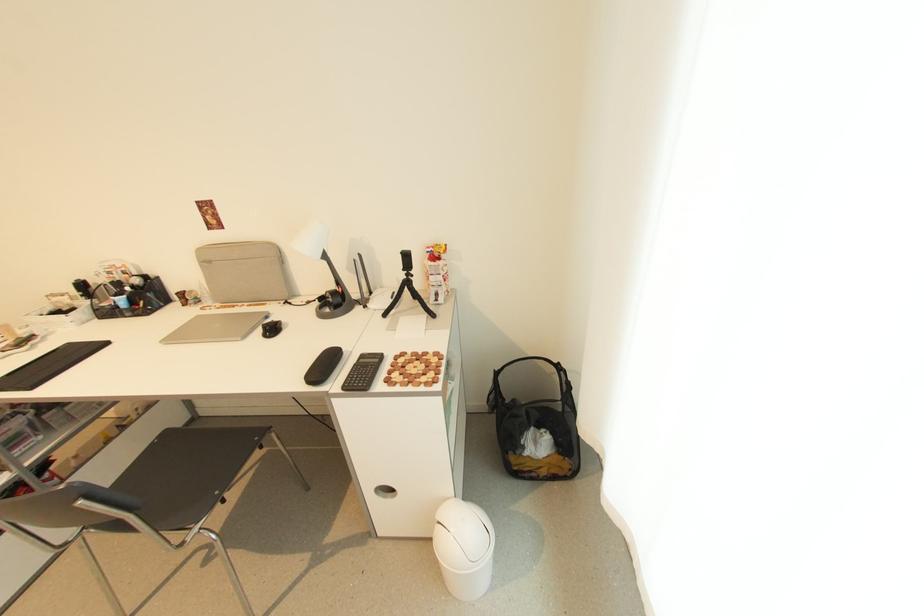
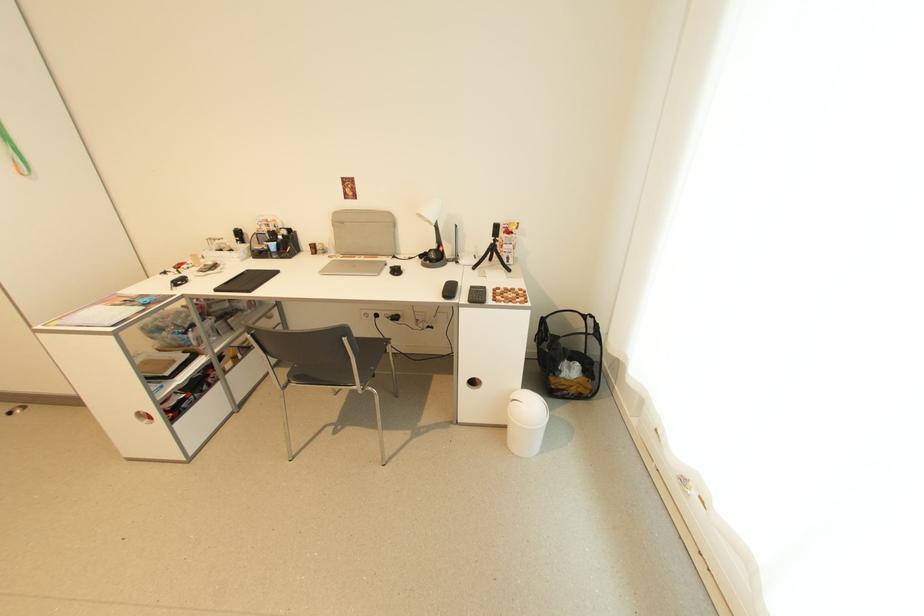
Where in the second image is the point corresponding to (272,318) from the first image?

(391, 265)